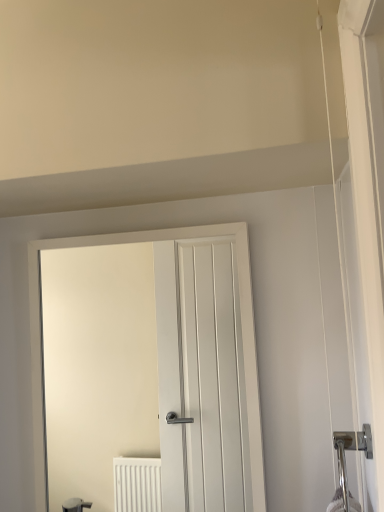
Question: Is white matte door at center at the right side of polished chrome door handle at right?

Choices:
 (A) yes
 (B) no

Answer: (B)

Question: From a real-world perspective, is white matte door at center over polished chrome door handle at right?

Choices:
 (A) yes
 (B) no

Answer: (A)

Question: Is white matte door at center in front of polished chrome door handle at right?

Choices:
 (A) no
 (B) yes

Answer: (A)

Question: Can you confirm if white matte door at center is smaller than polished chrome door handle at right?

Choices:
 (A) no
 (B) yes

Answer: (A)

Question: Does white matte door at center touch polished chrome door handle at right?

Choices:
 (A) no
 (B) yes

Answer: (A)

Question: Is polished chrome door handle at right located within white matte door at center?

Choices:
 (A) no
 (B) yes

Answer: (A)

Question: Considering the relative positions of polished chrome door handle at right and white matte door at center in the image provided, is polished chrome door handle at right to the right of white matte door at center from the viewer's perspective?

Choices:
 (A) yes
 (B) no

Answer: (A)

Question: Can you confirm if polished chrome door handle at right is wider than white matte door at center?

Choices:
 (A) no
 (B) yes

Answer: (B)

Question: Is white matte door at center completely or partially inside polished chrome door handle at right?

Choices:
 (A) no
 (B) yes

Answer: (A)

Question: Is polished chrome door handle at right behind white matte door at center?

Choices:
 (A) no
 (B) yes

Answer: (A)

Question: Is polished chrome door handle at right aimed at white matte door at center?

Choices:
 (A) yes
 (B) no

Answer: (B)

Question: From the image's perspective, is polished chrome door handle at right over white matte door at center?

Choices:
 (A) yes
 (B) no

Answer: (B)

Question: Considering the positions of polished chrome door handle at right and white matte door at center in the image, is polished chrome door handle at right wider or thinner than white matte door at center?

Choices:
 (A) thin
 (B) wide

Answer: (B)